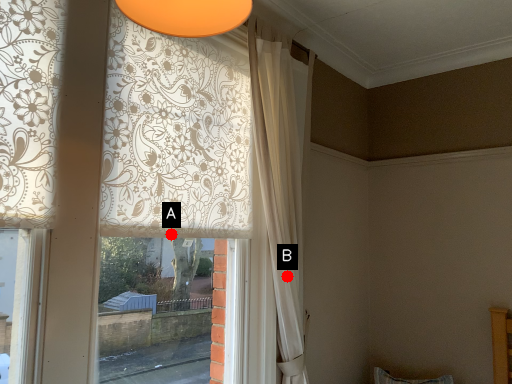
Question: Two points are circled on the image, labeled by A and B beside each circle. Which point appears closest to the camera in this image?

Choices:
 (A) A is closer
 (B) B is closer

Answer: (A)